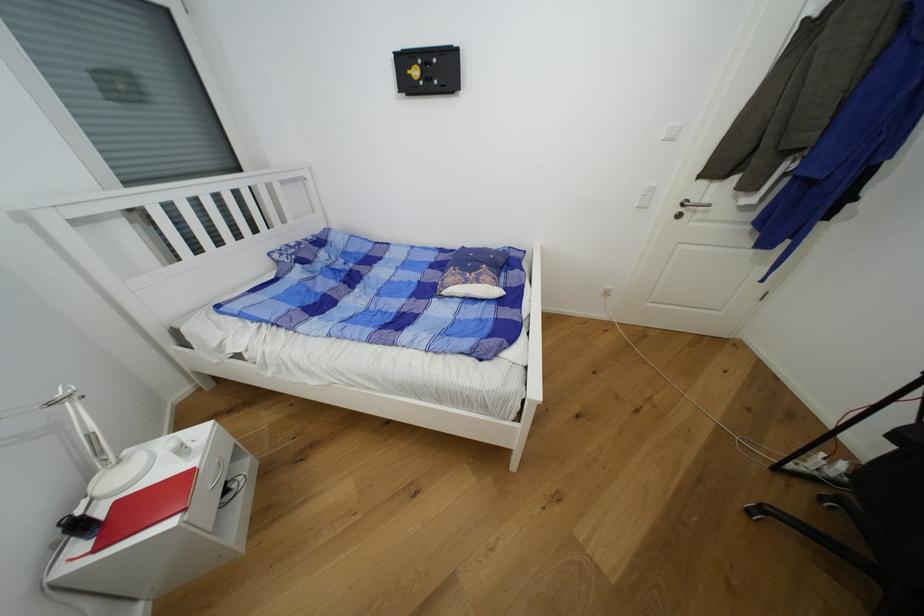
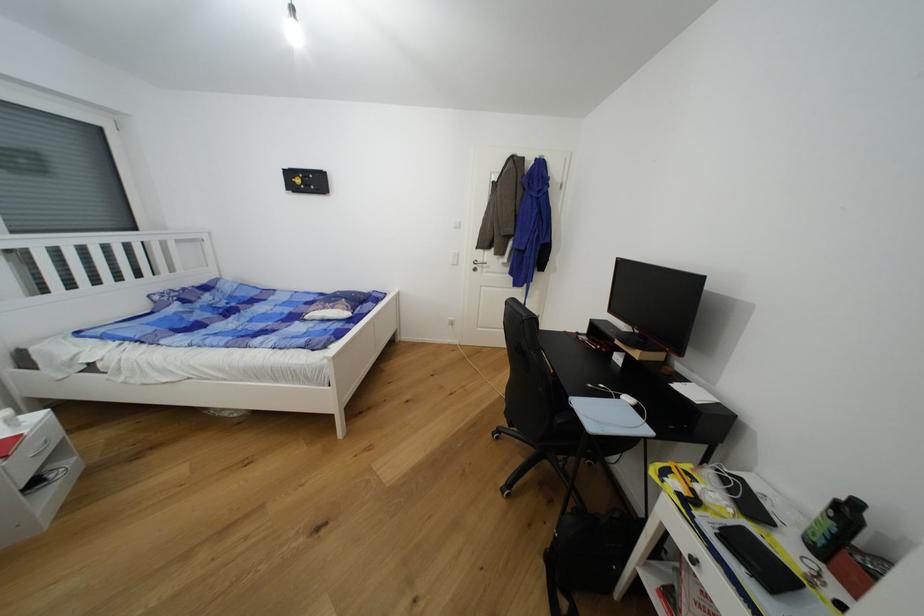
The images are taken continuously from a first-person perspective. In which direction are you moving?

The movement direction of the cameraman is right, backward.